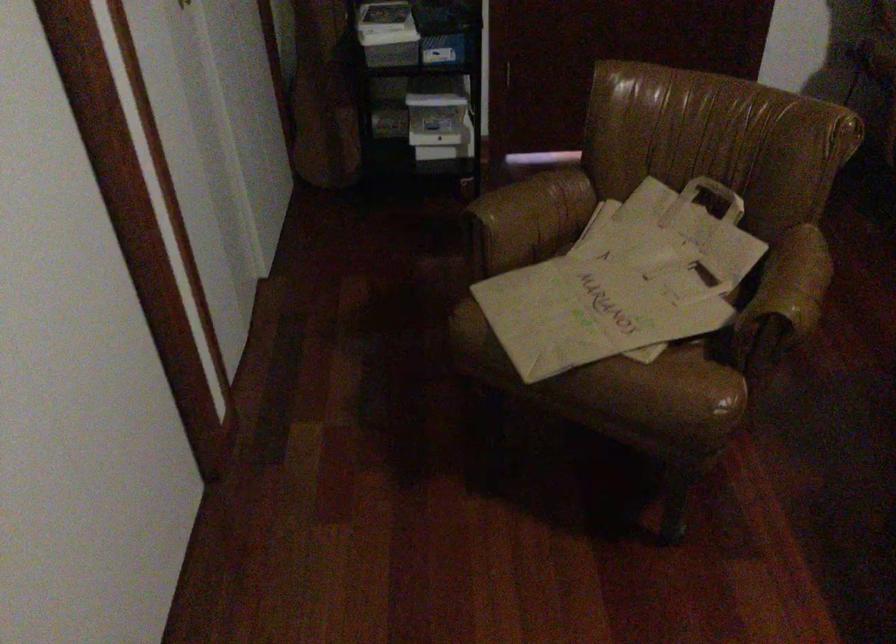
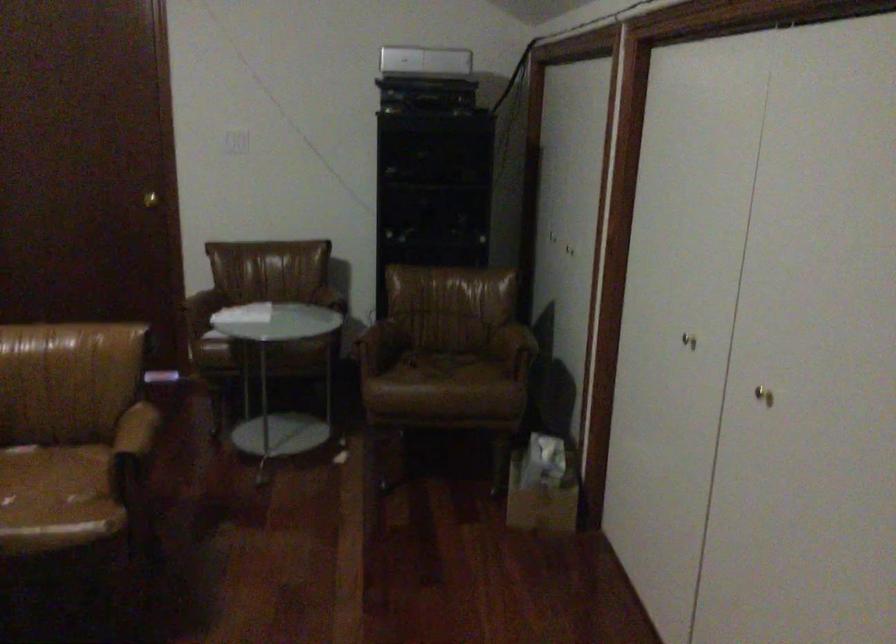
What movement of the cameraman would produce the second image?

The cameraman moved toward right, backward.